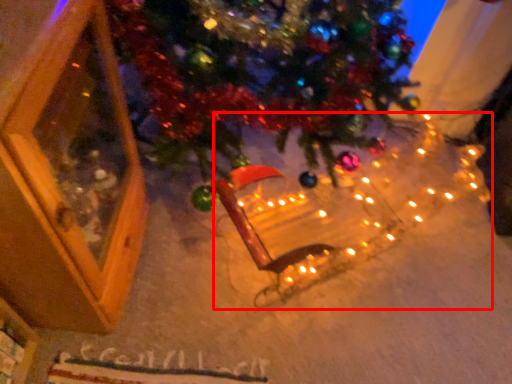
Question: From the image's perspective, considering the relative positions of christmas light (annotated by the red box) and screen door in the image provided, where is christmas light (annotated by the red box) located with respect to the staircase?

Choices:
 (A) above
 (B) below

Answer: (B)